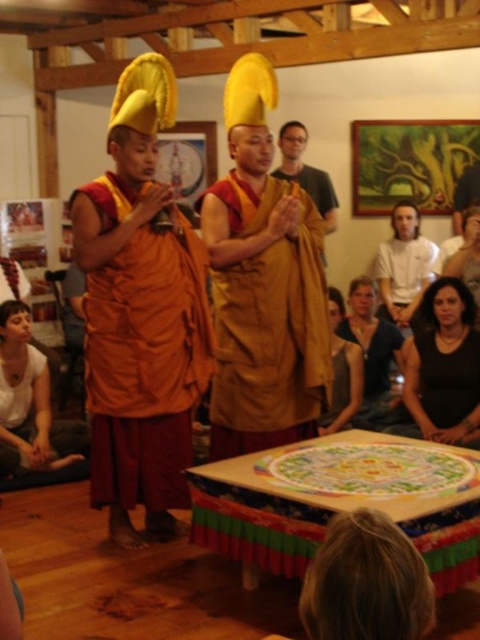
Does orange clothed monk at left appear over golden robe monk at center?

Actually, orange clothed monk at left is below golden robe monk at center.

Does orange clothed monk at left have a greater width compared to golden robe monk at center?

Yes, orange clothed monk at left is wider than golden robe monk at center.

What do you see at coordinates (141, 314) in the screenshot? I see `orange clothed monk at left` at bounding box center [141, 314].

Where is `orange clothed monk at left`? orange clothed monk at left is located at coordinates (141, 314).

How far apart are matte gold robe at center and smooth brown leather jacket at lower right?

The distance of matte gold robe at center from smooth brown leather jacket at lower right is 3.11 meters.

Based on the photo, which of these two, matte gold robe at center or smooth brown leather jacket at lower right, stands taller?

Standing taller between the two is matte gold robe at center.

Does point (230, 435) come farther from viewer compared to point (467, 177)?

No, it is in front of (467, 177).

Locate an element on the screen. matte gold robe at center is located at coordinates (263, 284).

Which is behind, point (252, 134) or point (312, 179)?

Positioned behind is point (312, 179).

Is matte gold robe at center thinner than golden robe monk at center?

Incorrect, matte gold robe at center's width is not less than golden robe monk at center's.

The height and width of the screenshot is (640, 480). I want to click on matte gold robe at center, so click(x=263, y=284).

Where is `matte gold robe at center`? The height and width of the screenshot is (640, 480). matte gold robe at center is located at coordinates (263, 284).